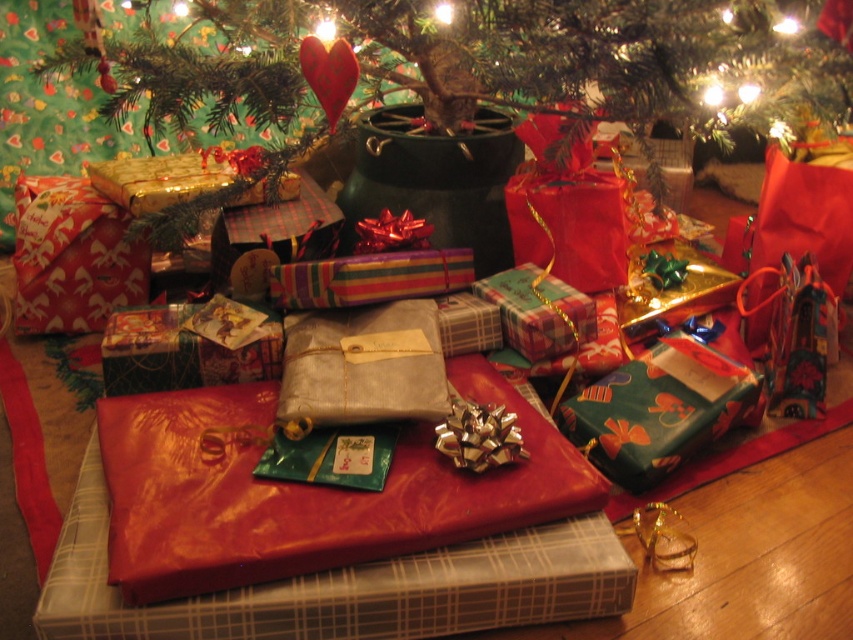
Question: Among these objects, which one is farthest from the camera?

Choices:
 (A) green matte christmas tree at center
 (B) plaid paper gift at center

Answer: (B)

Question: Does green paper gift at center have a larger size compared to red shiny paper gift at left?

Choices:
 (A) no
 (B) yes

Answer: (B)

Question: Considering the real-world distances, which object is farthest from the red shiny paper gift at left?

Choices:
 (A) green matte christmas tree at center
 (B) plaid paper gift at center
 (C) green paper gift at center

Answer: (C)

Question: Which point appears farthest from the camera in this image?

Choices:
 (A) [33, 300]
 (B) [270, 124]
 (C) [598, 465]

Answer: (B)

Question: Is green matte christmas tree at center smaller than red shiny paper gift at left?

Choices:
 (A) no
 (B) yes

Answer: (A)

Question: Can you confirm if green paper gift at center is thinner than plaid paper gift at center?

Choices:
 (A) no
 (B) yes

Answer: (A)